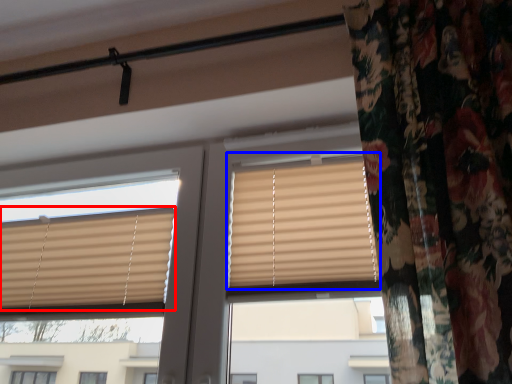
Question: Among these objects, which one is farthest to the camera, window blind (highlighted by a red box) or window (highlighted by a blue box)?

Choices:
 (A) window blind
 (B) window

Answer: (A)